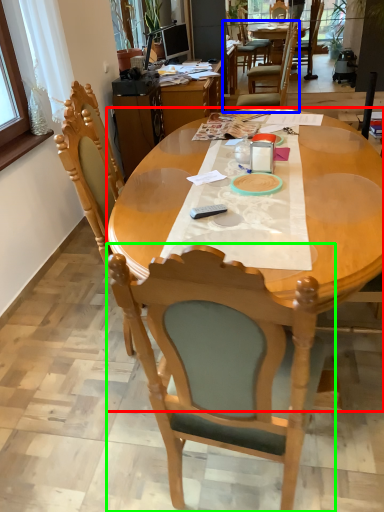
Question: Which is nearer to the kitchen & dining room table (highlighted by a red box)? chair (highlighted by a blue box) or chair (highlighted by a green box).

Choices:
 (A) chair
 (B) chair

Answer: (B)